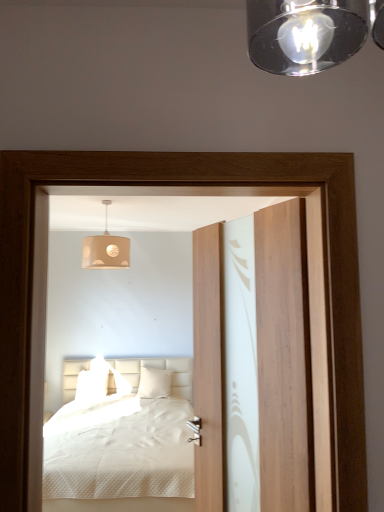
What do you see at coordinates (199, 226) in the screenshot? The image size is (384, 512). I see `transparent wood screen door at center` at bounding box center [199, 226].

Image resolution: width=384 pixels, height=512 pixels. What are the coordinates of `beige fabric lampshade at upper center` in the screenshot? It's located at (105, 249).

This screenshot has width=384, height=512. Find the location of `wooden door at center`. wooden door at center is located at coordinates (284, 359).

What are the coordinates of `bed in front of the beige fabric lampshade at upper center` in the screenshot? It's located at (123, 446).

Based on the photo, considering the positions of objects beige fabric lampshade at upper center and white textured bed at center in the image provided, who is behind, beige fabric lampshade at upper center or white textured bed at center?

beige fabric lampshade at upper center is more distant.

From the image's perspective, between beige fabric lampshade at upper center and white textured bed at center, which one is located above?

beige fabric lampshade at upper center appears higher in the image.

Does wooden door at center contain white soft pillow at center?

No, wooden door at center does not contain white soft pillow at center.

Based on the photo, how different are the orientations of wooden door at center and white soft pillow at center in degrees?

The facing directions of wooden door at center and white soft pillow at center are 64 degrees apart.

Measure the distance between wooden door at center and white soft pillow at center.

wooden door at center and white soft pillow at center are 3.65 meters apart from each other.

Which point is more forward, (282, 236) or (169, 390)?

The point (282, 236) is closer to the camera.

Considering the relative sizes of white textured bed at center and wooden door at center in the image provided, is white textured bed at center bigger than wooden door at center?

Indeed, white textured bed at center has a larger size compared to wooden door at center.

From a real-world perspective, is white textured bed at center on top of wooden door at center?

No, from a real-world perspective, white textured bed at center is not over wooden door at center

How many degrees apart are the facing directions of white textured bed at center and wooden door at center?

The angular difference between white textured bed at center and wooden door at center is 65.9 degrees.

Is white textured bed at center wider or thinner than wooden door at center?

In the image, white textured bed at center appears to be wider than wooden door at center.

How different are the orientations of transparent wood screen door at center and wooden door at center in degrees?

114 degrees.

Is transparent wood screen door at center aimed at wooden door at center?

Yes, transparent wood screen door at center is oriented towards wooden door at center.

From the image's perspective, which one is positioned higher, transparent wood screen door at center or wooden door at center?

transparent wood screen door at center.

Considering the sizes of objects transparent wood screen door at center and wooden door at center in the image provided, who is shorter, transparent wood screen door at center or wooden door at center?

With less height is transparent wood screen door at center.

Considering the positions of objects white textured bed at center and beige fabric lampshade at upper center in the image provided, who is more to the left, white textured bed at center or beige fabric lampshade at upper center?

beige fabric lampshade at upper center.

Is white textured bed at center oriented towards beige fabric lampshade at upper center?

No, white textured bed at center is not oriented towards beige fabric lampshade at upper center.

Which of these two, white textured bed at center or beige fabric lampshade at upper center, stands taller?

Standing taller between the two is white textured bed at center.

At what (x,y) coordinates should I click in order to perform the action: click on lamp above the white textured bed at center (from a real-world perspective). Please return your answer as a coordinate pair (x, y). The height and width of the screenshot is (512, 384). Looking at the image, I should click on (105, 249).

From the picture: Is wooden door at center completely or partially outside of white textured bed at center?

Absolutely, wooden door at center is external to white textured bed at center.

How many degrees apart are the facing directions of wooden door at center and white textured bed at center?

65.9 degrees separate the facing orientations of wooden door at center and white textured bed at center.

Is wooden door at center positioned before white textured bed at center?

Yes, wooden door at center is closer to the viewer.

Is wooden door at center at the left side of white textured bed at center?

No.

Is transparent wood screen door at center next to beige fabric lampshade at upper center and touching it?

No, transparent wood screen door at center is not touching beige fabric lampshade at upper center.

Consider the image. Is transparent wood screen door at center taller or shorter than beige fabric lampshade at upper center?

In the image, transparent wood screen door at center appears to be taller than beige fabric lampshade at upper center.

From the image's perspective, between transparent wood screen door at center and beige fabric lampshade at upper center, which one is located above?

beige fabric lampshade at upper center.

Identify the location of bed that is under the beige fabric lampshade at upper center (from a real-world perspective). Image resolution: width=384 pixels, height=512 pixels. (123, 446).

Find the location of a particular element. The width and height of the screenshot is (384, 512). door lying above the white soft pillow at center (from the image's perspective) is located at coordinates (284, 359).

Which object lies nearer to the anchor point wooden door at center, beige fabric lampshade at upper center or white textured bed at center?

beige fabric lampshade at upper center lies closer to wooden door at center than the other object.

Looking at the image, which one is located closer to wooden door at center, white soft pillow at center or white textured bed at center?

white textured bed at center is positioned closer to the anchor wooden door at center.

Based on the photo, considering their positions, is beige fabric lampshade at upper center positioned closer to wooden door at center than white soft pillow at center?

beige fabric lampshade at upper center.

From the image, which object appears to be nearer to transparent wood screen door at center, wooden door at center or beige fabric lampshade at upper center?

Based on the image, beige fabric lampshade at upper center appears to be nearer to transparent wood screen door at center.

Which object lies further to the anchor point white textured bed at center, wooden door at center or transparent wood screen door at center?

wooden door at center lies further to white textured bed at center than the other object.

Estimate the real-world distances between objects in this image. Which object is closer to transparent wood screen door at center, white soft pillow at center or wooden door at center?

Among the two, white soft pillow at center is located nearer to transparent wood screen door at center.

Which object lies further to the anchor point wooden door at center, white textured bed at center or white soft pillow at center?

The object further to wooden door at center is white soft pillow at center.

Estimate the real-world distances between objects in this image. Which object is further from beige fabric lampshade at upper center, wooden door at center or transparent wood screen door at center?

wooden door at center lies further to beige fabric lampshade at upper center than the other object.

The image size is (384, 512). In order to click on door located between transparent wood screen door at center and white soft pillow at center in the depth direction in this screenshot , I will do `click(284, 359)`.

Image resolution: width=384 pixels, height=512 pixels. In order to click on door between transparent wood screen door at center and beige fabric lampshade at upper center in the front-back direction in this screenshot , I will do `click(284, 359)`.

This screenshot has height=512, width=384. I want to click on bed between wooden door at center and white soft pillow at center in the front-back direction, so pyautogui.click(x=123, y=446).

Locate an element on the screen. The image size is (384, 512). door located between transparent wood screen door at center and white textured bed at center in the depth direction is located at coordinates (284, 359).